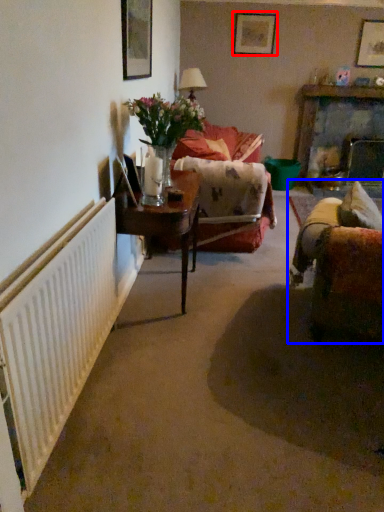
Question: Which of the following is the closest to the observer, picture frame (highlighted by a red box) or studio couch (highlighted by a blue box)?

Choices:
 (A) picture frame
 (B) studio couch

Answer: (B)